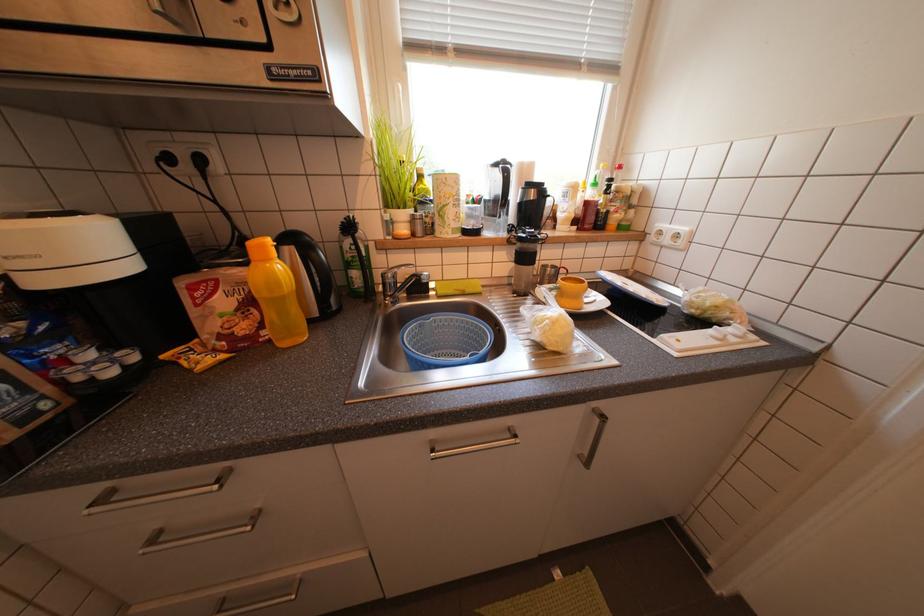
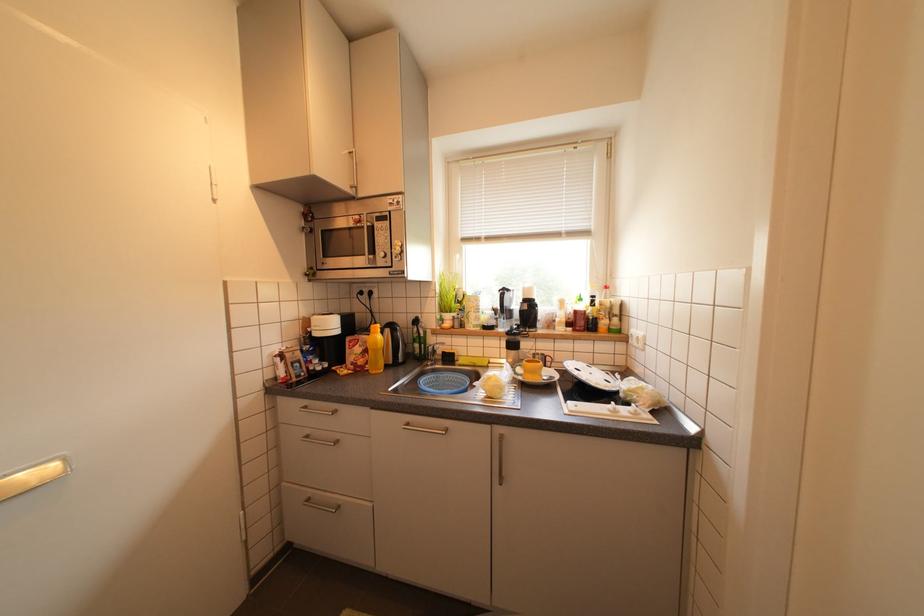
The first image is from the beginning of the video and the second image is from the end. How did the camera likely rotate when shooting the video?

The rotation direction of the camera is left-up.